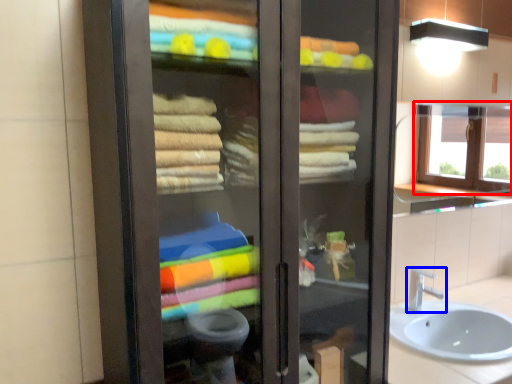
Question: Which object is further to the camera taking this photo, window (highlighted by a red box) or tap (highlighted by a blue box)?

Choices:
 (A) window
 (B) tap

Answer: (A)